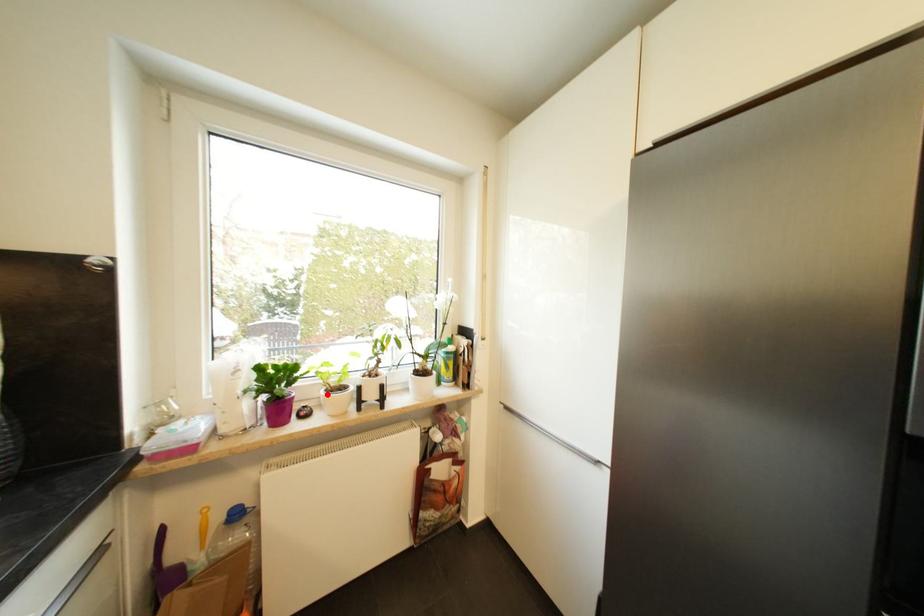
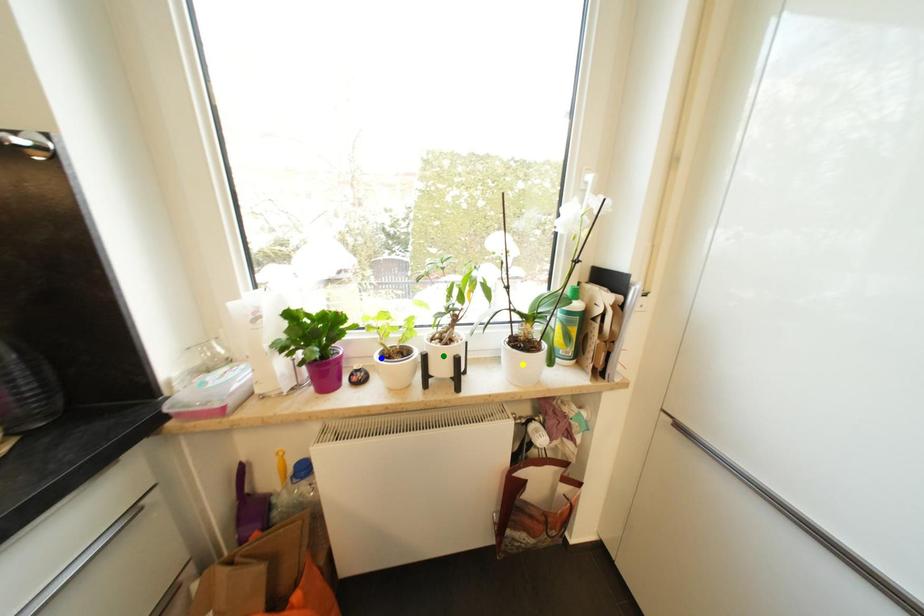
Question: I am providing you with two images of the same scene from different viewpoints. A red point is marked on the first image. You are given multiple points on the second image. Which point in image 2 is actually the same real-world point as the red point in image 1?

Choices:
 (A) green point
 (B) yellow point
 (C) blue point

Answer: (C)